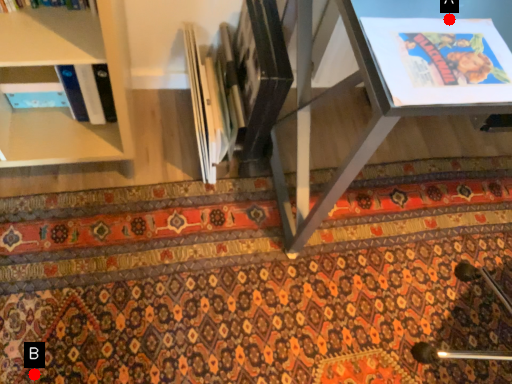
Question: Two points are circled on the image, labeled by A and B beside each circle. Which point is closer to the camera?

Choices:
 (A) A is closer
 (B) B is closer

Answer: (A)